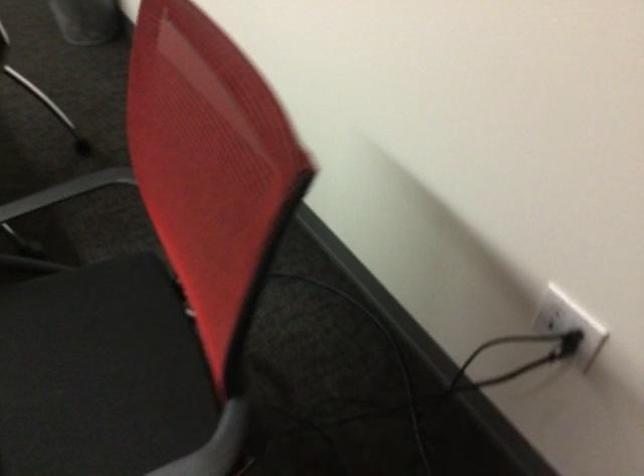
What do you see at coordinates (93, 372) in the screenshot? The image size is (644, 476). I see `the chair sitting surface` at bounding box center [93, 372].